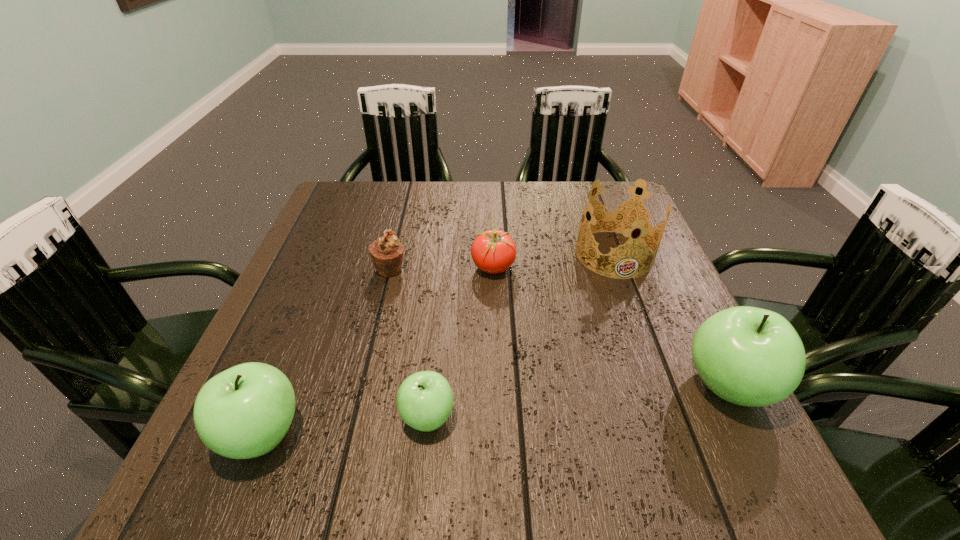
This screenshot has width=960, height=540. In order to click on the leftmost apple in this screenshot , I will do `click(244, 412)`.

Where is `the second shortest apple`? This screenshot has height=540, width=960. the second shortest apple is located at coordinates (244, 412).

Locate an element on the screen. This screenshot has height=540, width=960. the third object from left to right is located at coordinates (424, 400).

Find the location of `the second apple from left to right`. the second apple from left to right is located at coordinates (424, 400).

At what (x,y) coordinates should I click in order to perform the action: click on the rightmost apple. Please return your answer as a coordinate pair (x, y). This screenshot has width=960, height=540. Looking at the image, I should click on (749, 356).

In order to click on crown in this screenshot , I will do `click(623, 218)`.

This screenshot has height=540, width=960. I want to click on the fifth object from right to left, so click(x=386, y=253).

Where is `the third object from right to left`? the third object from right to left is located at coordinates (493, 251).

The image size is (960, 540). I want to click on vacant space situated 0.300m on the right of the leftmost apple, so click(485, 434).

Where is `free space located on the left of the shortest apple`? The width and height of the screenshot is (960, 540). free space located on the left of the shortest apple is located at coordinates (231, 417).